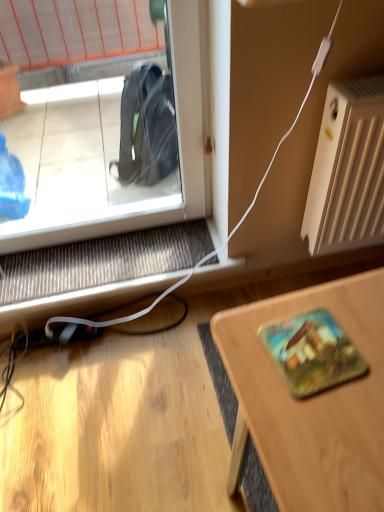
The height and width of the screenshot is (512, 384). Find the location of `free space above wooden desk at lower right (from a real-world perspective)`. free space above wooden desk at lower right (from a real-world perspective) is located at coordinates (331, 372).